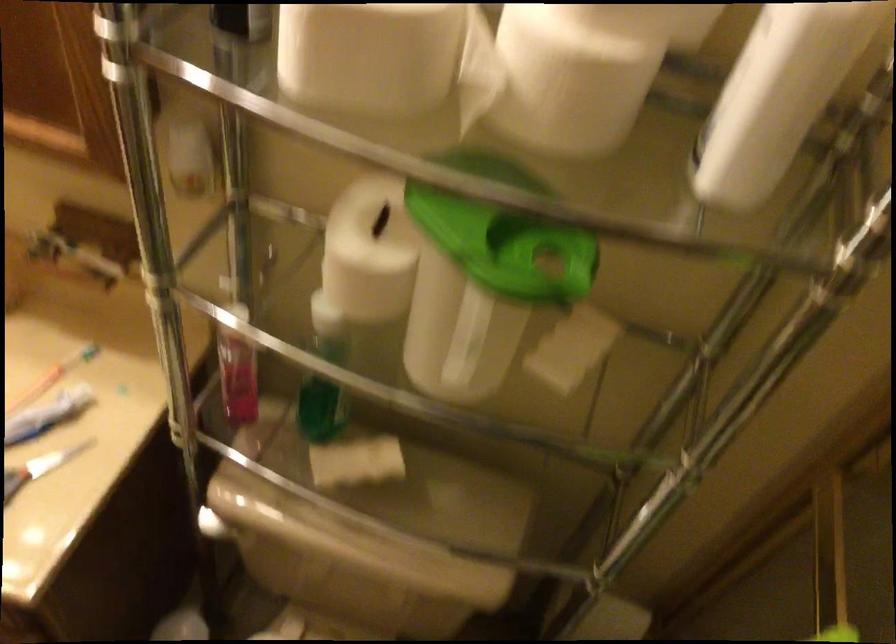
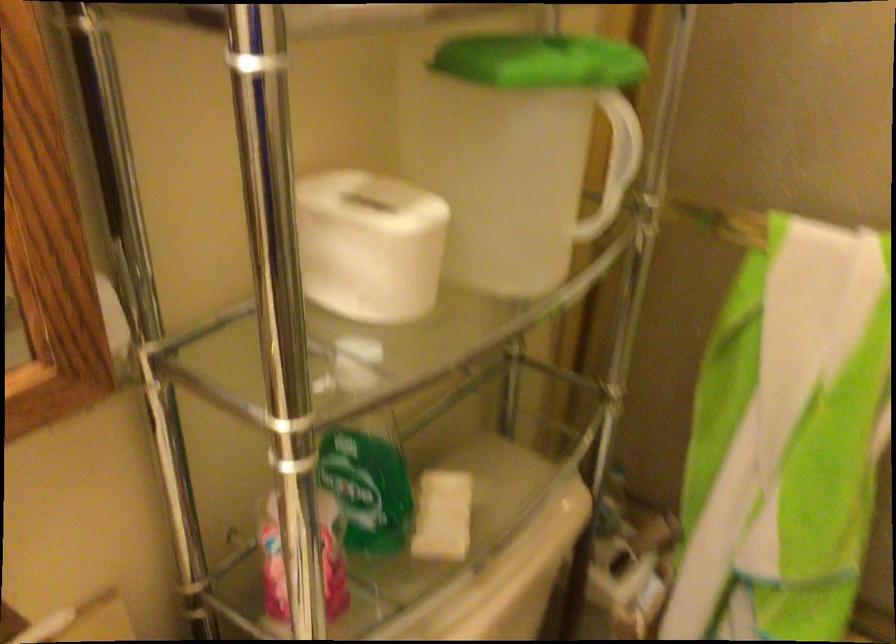
Find the pixel in the second image that matches point (347, 453) in the first image.

(442, 516)